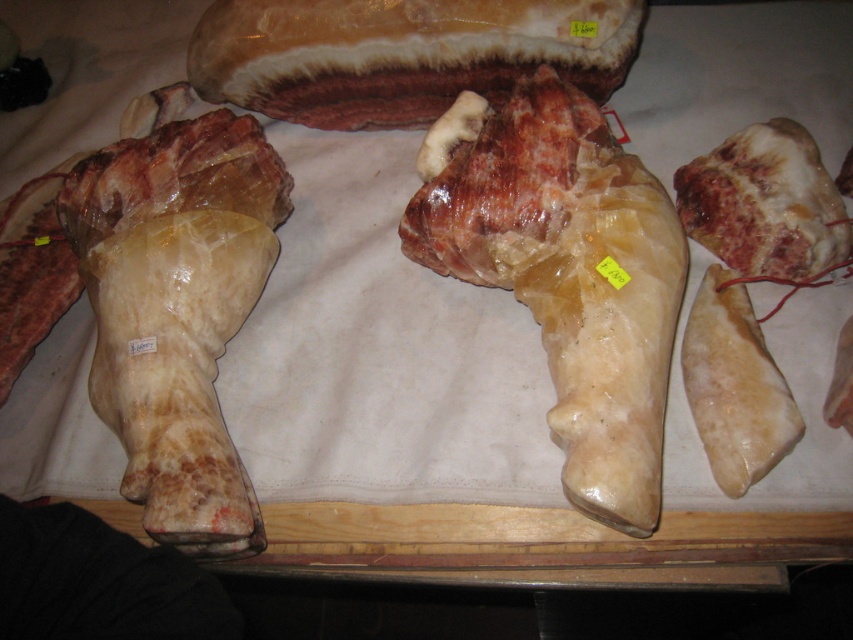
Question: Which object appears closest to the camera in this image?

Choices:
 (A) glossy white meat at upper center
 (B) translucent gelatinous leg at center
 (C) translucent white bone at left
 (D) fatty white meat at right

Answer: (B)

Question: Can you confirm if translucent gelatinous leg at center is smaller than glossy white meat at upper center?

Choices:
 (A) no
 (B) yes

Answer: (A)

Question: Which of the following is the farthest from the observer?

Choices:
 (A) glossy white meat at upper center
 (B) yellowish-fat ham at right
 (C) translucent gelatinous leg at center

Answer: (A)

Question: Can you confirm if translucent gelatinous leg at center is positioned to the right of translucent white bone at left?

Choices:
 (A) yes
 (B) no

Answer: (A)

Question: Which point is closer to the camera?

Choices:
 (A) (619, 58)
 (B) (691, 401)
 (C) (502, 268)
 (D) (701, 157)

Answer: (B)

Question: Is glossy white meat at upper center smaller than fatty white meat at right?

Choices:
 (A) no
 (B) yes

Answer: (A)